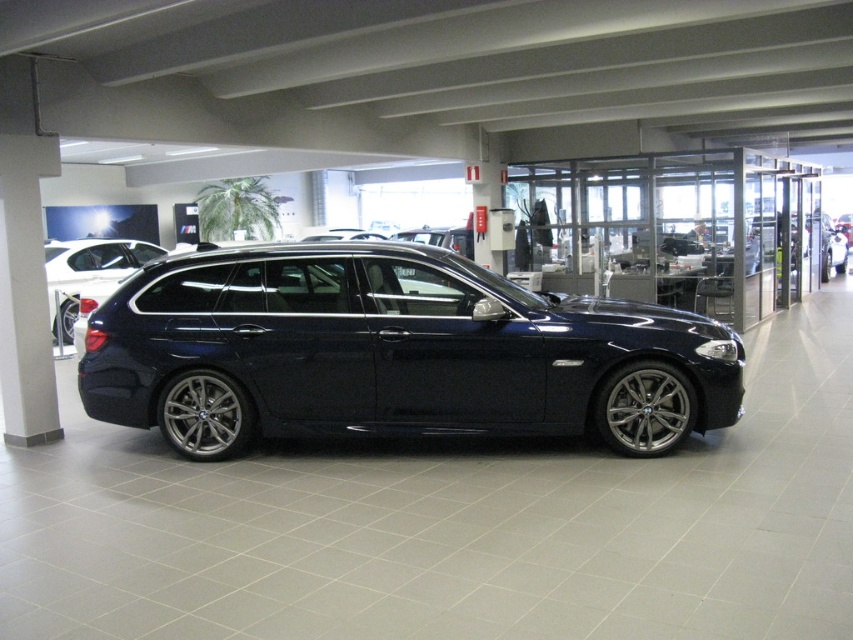
You are standing in the showroom and want to take a photo of the satin black sedan at center from directly in front of it. Based on the coordinates provided, where should you position yourself relative to the car to ensure the best frontal view?

To capture the best frontal view of the satin black sedan at center, position yourself directly in front of its 2D location at point (393, 353). This ensures the camera is aligned with the car, providing a clear and centered composition.

Based on the photo, you are a photographer setting up a shoot in the showroom. You want to position a light source to the left of the white glossy pillar at left and to the right of the satin black car at center. Is this possible given their current positions?

The white glossy pillar at left is actually to the right of the satin black car at center, so placing a light source to the left of the white glossy pillar at left and to the right of the satin black car at center is possible because the pillar is positioned to the right of the car, creating space between them for the light source.

You are a delivery person who needs to unload a package that requires 8 meters of space between two cars. You see the satin black sedan at center and the glossy dark blue sedan at center in the showroom. Can you fit your delivery vehicle between them?

The satin black sedan at center and glossy dark blue sedan at center are 8.34 meters apart, which is more than the required 8 meters of space. Therefore, the delivery vehicle can fit between them.